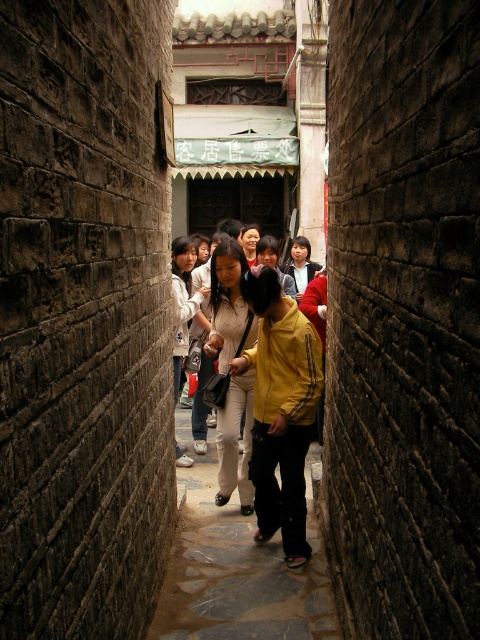
Question: Which of the following is the farthest from the observer?

Choices:
 (A) matte white pants at center
 (B) stone paved path at center

Answer: (A)

Question: Is stone paved path at center below matte white pants at center?

Choices:
 (A) yes
 (B) no

Answer: (A)

Question: Can you confirm if stone paved path at center is wider than matte white pants at center?

Choices:
 (A) yes
 (B) no

Answer: (A)

Question: Among these points, which one is farthest from the camera?

Choices:
 (A) (211, 451)
 (B) (216, 307)

Answer: (A)

Question: Among these points, which one is farthest from the camera?

Choices:
 (A) (250, 410)
 (B) (181, 598)

Answer: (A)

Question: Can you confirm if stone paved path at center is positioned above matte white pants at center?

Choices:
 (A) no
 (B) yes

Answer: (A)